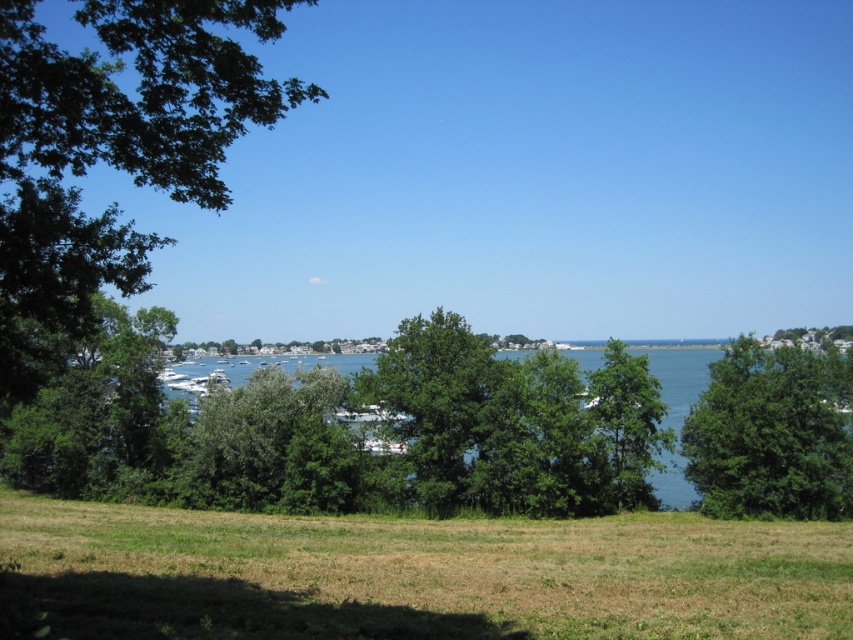
Question: Which of the following is the closest to the observer?

Choices:
 (A) (16, 592)
 (B) (630, 381)

Answer: (A)

Question: Is green leafy tree at right to the right of green leafy tree at center from the viewer's perspective?

Choices:
 (A) yes
 (B) no

Answer: (A)

Question: Can you confirm if green grassy field at lower center is positioned to the left of green leafy tree at center?

Choices:
 (A) yes
 (B) no

Answer: (A)

Question: Which point is farther to the camera?

Choices:
 (A) green leafy tree at center
 (B) green leafy tree at center-right

Answer: (B)

Question: Does green leafy tree at center lie behind green leafy tree at center-right?

Choices:
 (A) no
 (B) yes

Answer: (A)

Question: Which of the following is the farthest from the observer?

Choices:
 (A) green leafy tree at right
 (B) green grassy field at lower center

Answer: (A)